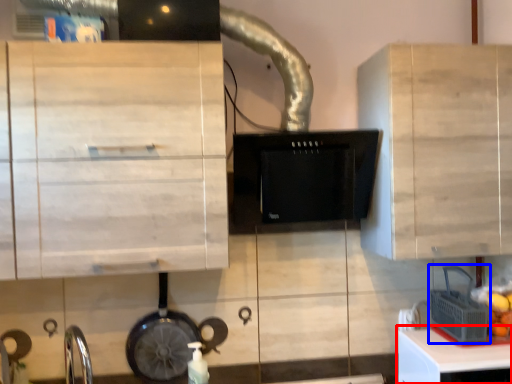
Question: Which of the following is the farthest to the observer, table (highlighted by a red box) or appliance (highlighted by a blue box)?

Choices:
 (A) table
 (B) appliance

Answer: (B)